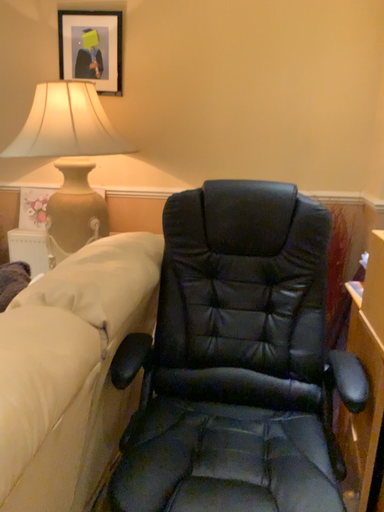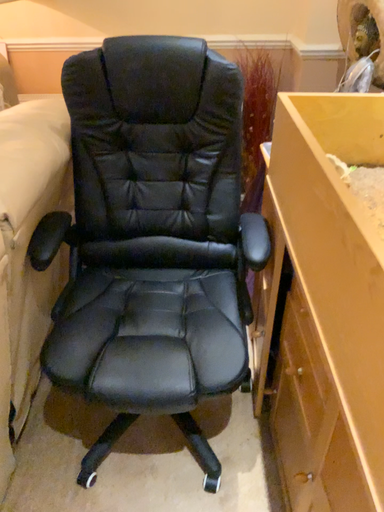
Question: Which way did the camera rotate in the video?

Choices:
 (A) rotated left
 (B) rotated right

Answer: (B)